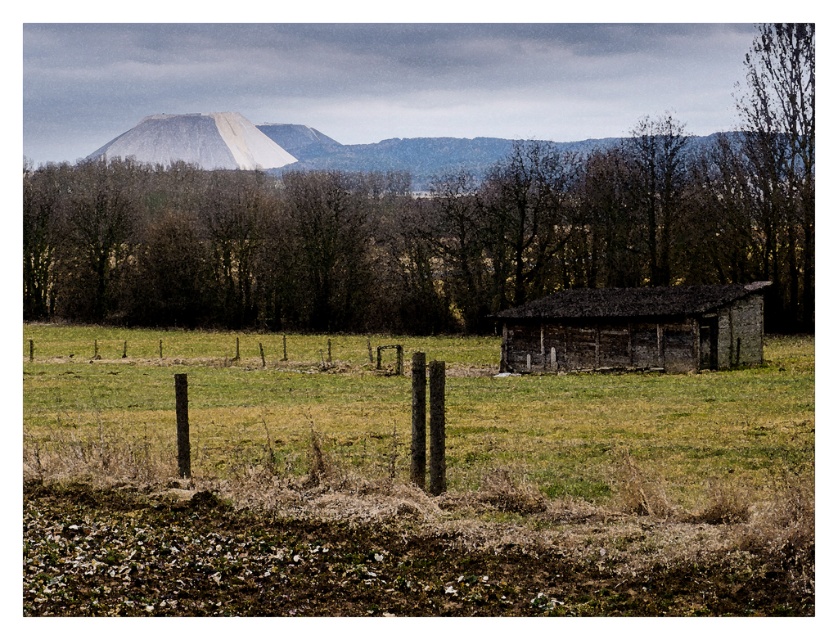
Question: Which point is farther to the camera?

Choices:
 (A) (327, 208)
 (B) (220, 120)
 (C) (748, 310)
 (D) (136, 364)

Answer: (B)

Question: Is brown textured tree at upper center to the right of brown wooden fence at center from the viewer's perspective?

Choices:
 (A) yes
 (B) no

Answer: (A)

Question: Estimate the real-world distances between objects in this image. Which object is farther from the green grass at center?

Choices:
 (A) white matte mountain at upper center
 (B) brown textured tree at upper center

Answer: (A)

Question: From the image, what is the correct spatial relationship of brown wooden fence at lower center in relation to weathered wood barn at center?

Choices:
 (A) right
 (B) left

Answer: (B)

Question: Can you confirm if green grass at center is positioned below weathered wood barn at center?

Choices:
 (A) no
 (B) yes

Answer: (B)

Question: Which object is closer to the camera taking this photo?

Choices:
 (A) brown wooden fence at lower center
 (B) green grass at center
 (C) white smooth mountain at upper center

Answer: (B)